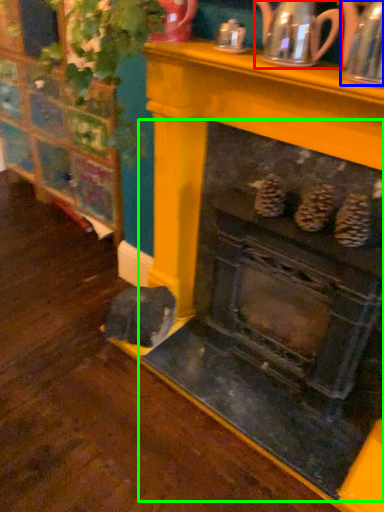
Question: Which is farther away from tea pot (highlighted by a red box)? tea pot (highlighted by a blue box) or fireplace (highlighted by a green box)?

Choices:
 (A) tea pot
 (B) fireplace

Answer: (B)